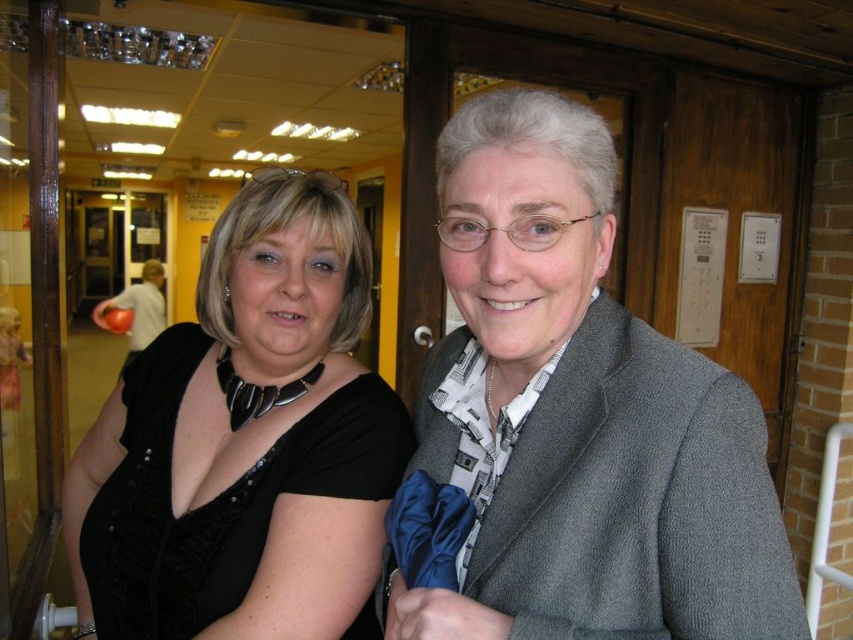
At what (x,y) coordinates should I click in order to perform the action: click on gray woolen jacket at upper right. Please return your answer as a coordinate pair (x, y). The image size is (853, 640). Looking at the image, I should click on (579, 417).

Who is positioned more to the right, gray woolen jacket at upper right or black satin dress at left?

gray woolen jacket at upper right is more to the right.

Measure the distance between point (598, 275) and camera.

Point (598, 275) is 28.76 inches from camera.

Find the location of a particular element. gray woolen jacket at upper right is located at coordinates (579, 417).